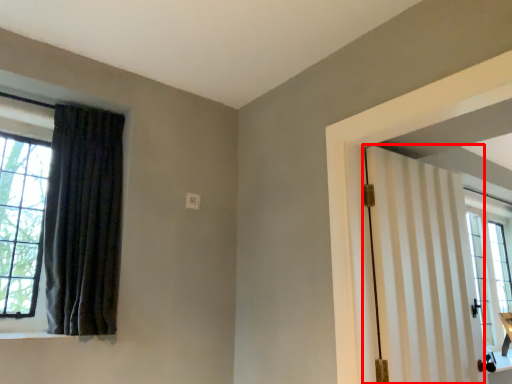
Question: In this image, where is door (annotated by the red box) located relative to curtain?

Choices:
 (A) right
 (B) left

Answer: (A)